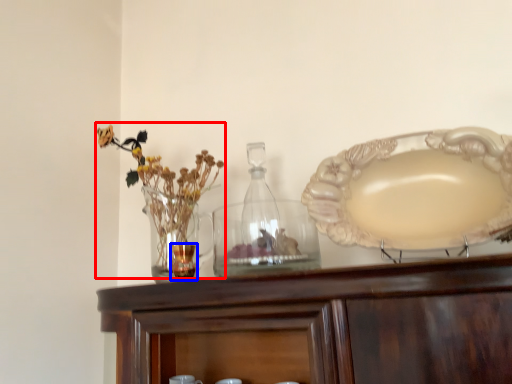
Question: Which of the following is the farthest to the observer, floral arrangement (highlighted by a red box) or tableware (highlighted by a blue box)?

Choices:
 (A) floral arrangement
 (B) tableware

Answer: (A)